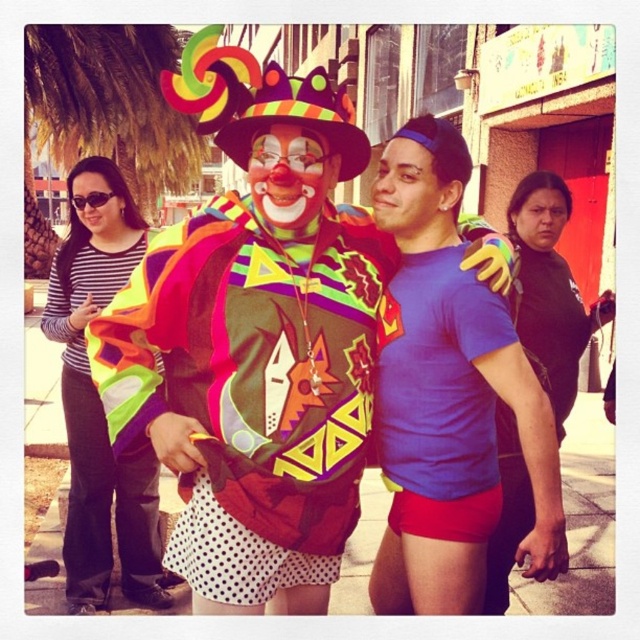
You are a photographer trying to frame a shot that includes both the matte clown costume at center and the striped fabric shirt at left. Since you want to ensure both are fully visible, which object should you focus on first to avoid cropping either?

The striped fabric shirt at left is taller than the matte clown costume at center. To ensure both are fully visible in the frame, focus on the taller object first, which is the striped fabric shirt at left, as it requires more vertical space.

You are a photographer setting up for a group photo. You need to ensure that both the matte clown costume at center and the striped fabric shirt at left are fully visible in the frame. Based on their positions and sizes, which subject should you position closer to the camera to avoid cropping either of them?

The matte clown costume at center might be wider than striped fabric shirt at left, so positioning the striped fabric shirt at left closer to the camera would help ensure both fit within the frame without cropping.